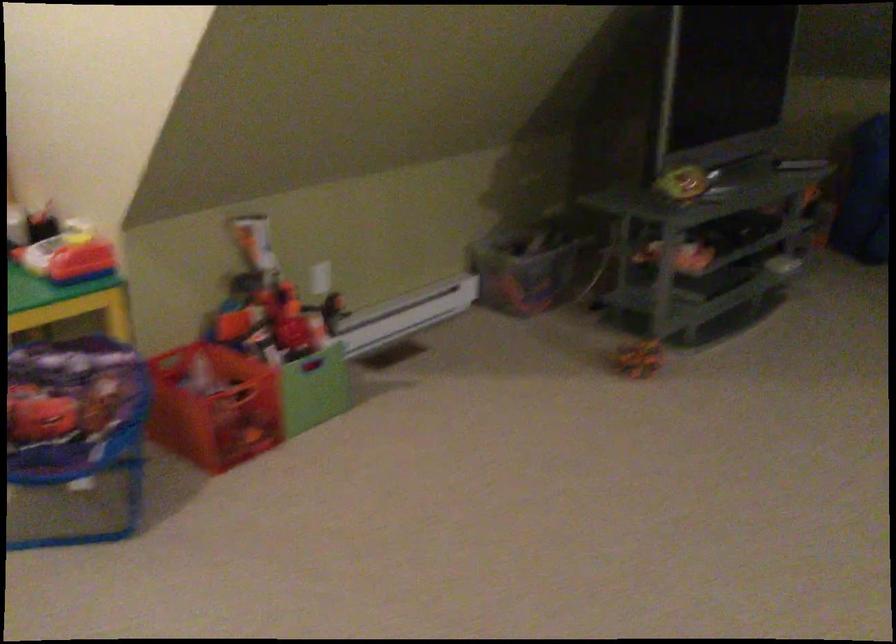
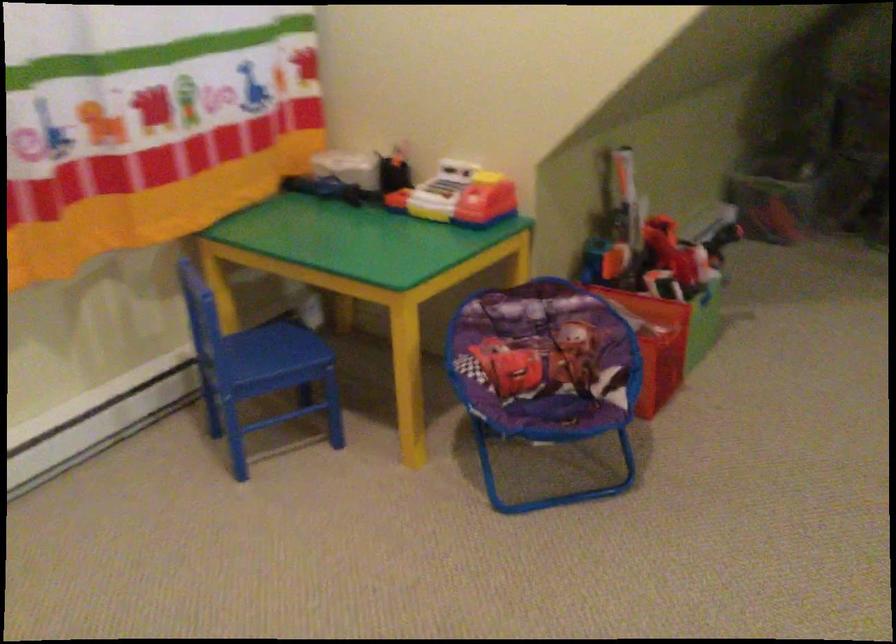
The point at (85, 424) is marked in the first image. Where is the corresponding point in the second image?

(546, 372)